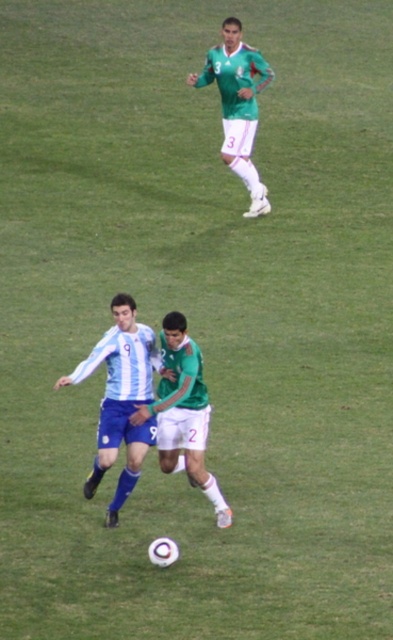
Consider the image. You are a soccer referee standing at the edge of the field. You need to determine which player is closer to you to make a call. The players are the blue jersey at center and the green matte jersey at upper center. Which one is closer?

The blue jersey at center is closer to the viewer than the green matte jersey at upper center, so the referee should call the blue jersey at center as the closer player.

You are a soccer coach analyzing the game from the sidelines. You notice two points marked on the field at coordinates point (x=152, y=403) and point (x=255, y=92). Which point is closer to your vantage point on the sidelines?

Point (x=152, y=403) is closer to the viewer than point (x=255, y=92), so the point closer to your vantage point on the sidelines is point (x=152, y=403).

You are a soccer referee observing the game. You notice the blue jersey at center and the green matte jersey at center. Which player is positioned to the left side between them?

The blue jersey at center is positioned to the left of the green matte jersey at center.